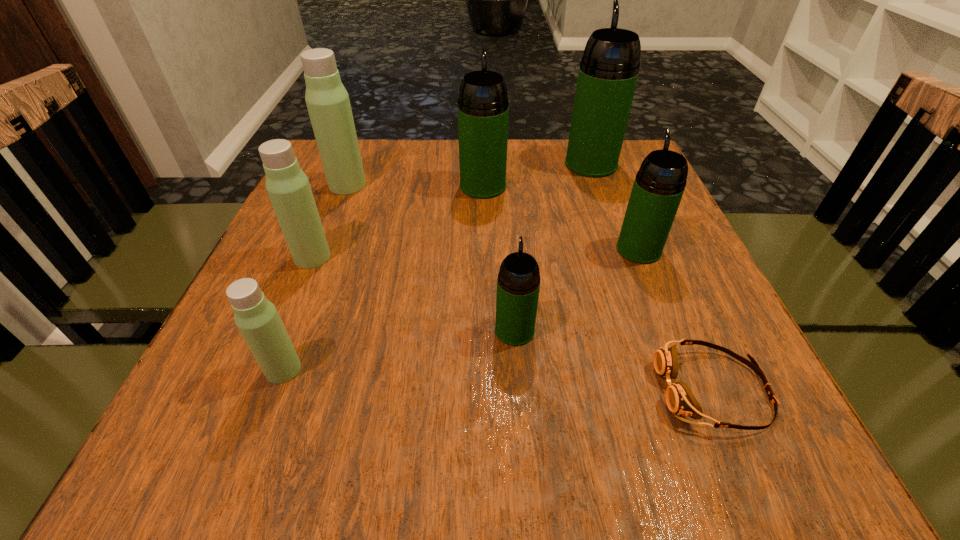
Find the location of `the tallest object`. the tallest object is located at coordinates pyautogui.click(x=608, y=72).

Locate an element on the screen. the tallest thermos bottle is located at coordinates (608, 72).

Identify the location of the third smallest green thermos bottle. (483, 108).

Identify the location of the farthest light thermos bottle. This screenshot has width=960, height=540. (328, 104).

At what (x,y) coordinates should I click in order to perform the action: click on the third farthest green thermos bottle. Please return your answer as a coordinate pair (x, y). The height and width of the screenshot is (540, 960). Looking at the image, I should click on (659, 185).

Locate an element on the screen. The width and height of the screenshot is (960, 540). the second farthest light thermos bottle is located at coordinates (288, 187).

You are a GUI agent. You are given a task and a screenshot of the screen. Output one action in this format:
    pyautogui.click(x=<x>, y=<y>)
    Task: Click on the second nearest thermos bottle
    
    Given the screenshot: What is the action you would take?
    pyautogui.click(x=518, y=283)

Find the location of a particular element. This screenshot has height=540, width=960. the smallest green thermos bottle is located at coordinates (518, 283).

This screenshot has height=540, width=960. In order to click on the nearest thermos bottle in this screenshot , I will do `click(257, 319)`.

This screenshot has width=960, height=540. I want to click on the nearest light thermos bottle, so click(257, 319).